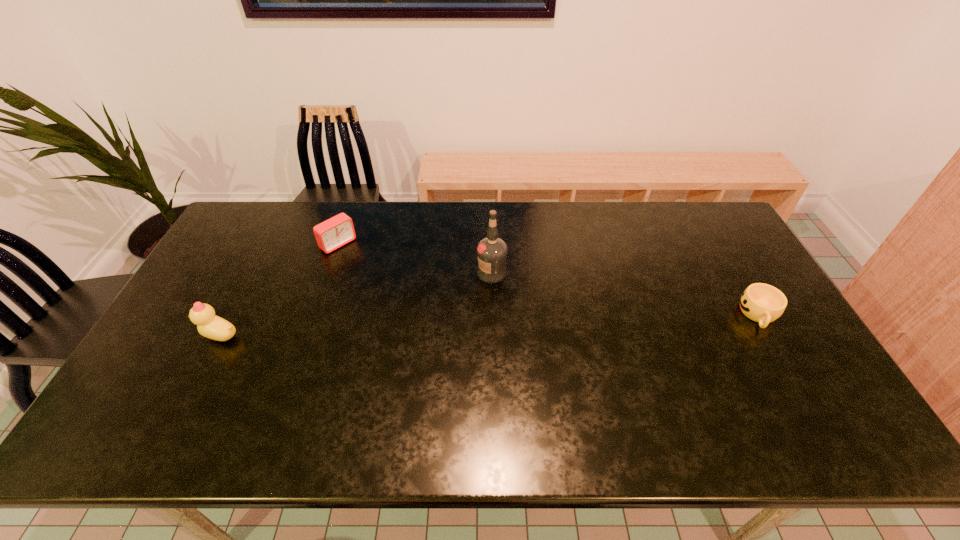
Find the location of a particular element. The image size is (960, 540). vacant point located on the front label of the second farthest object is located at coordinates (420, 371).

Identify the location of free space located 0.050m on the front label of the second farthest object. The image size is (960, 540). (477, 293).

The image size is (960, 540). Identify the location of vacant space located on the front-facing side of the alarm clock. (400, 296).

Find the location of a particular element. The height and width of the screenshot is (540, 960). free space located on the front-facing side of the alarm clock is located at coordinates (371, 272).

I want to click on vacant space positioned 0.100m on the front-facing side of the alarm clock, so click(x=366, y=267).

You are a GUI agent. You are given a task and a screenshot of the screen. Output one action in this format:
    pyautogui.click(x=<x>, y=<y>)
    Task: Click on the object situated at the far edge
    This screenshot has width=960, height=540.
    Given the screenshot: What is the action you would take?
    pyautogui.click(x=337, y=231)

You are a GUI agent. You are given a task and a screenshot of the screen. Output one action in this format:
    pyautogui.click(x=<x>, y=<y>)
    Task: Click on the object that is at the left edge
    
    Given the screenshot: What is the action you would take?
    pyautogui.click(x=209, y=325)

Identify the location of object situated at the right edge. Image resolution: width=960 pixels, height=540 pixels. (760, 302).

Locate an element on the screen. The width and height of the screenshot is (960, 540). free spot at the far edge of the desktop is located at coordinates (639, 233).

At what (x,y) coordinates should I click in order to perform the action: click on vacant space at the near edge of the desktop. Please return your answer as a coordinate pair (x, y). The width and height of the screenshot is (960, 540). Looking at the image, I should click on (534, 397).